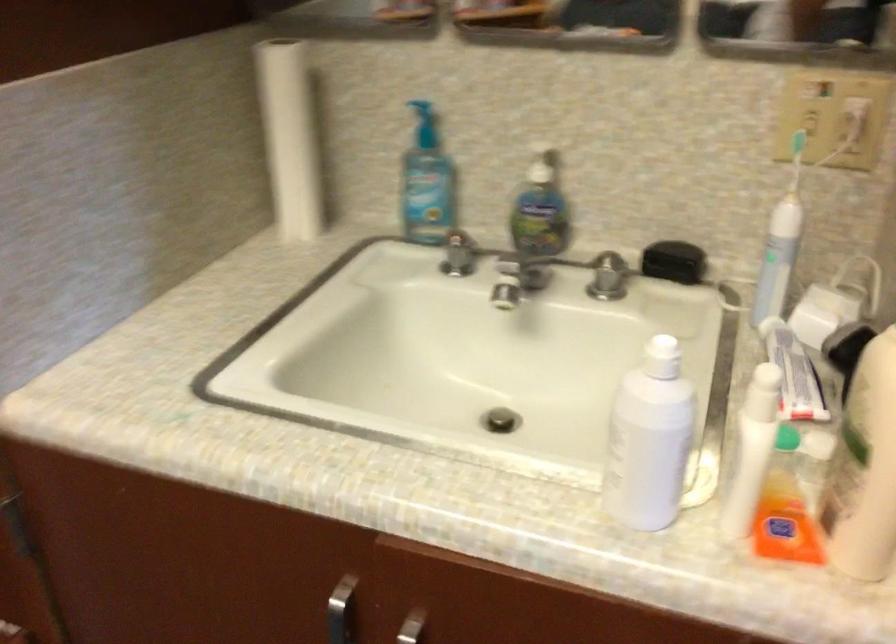
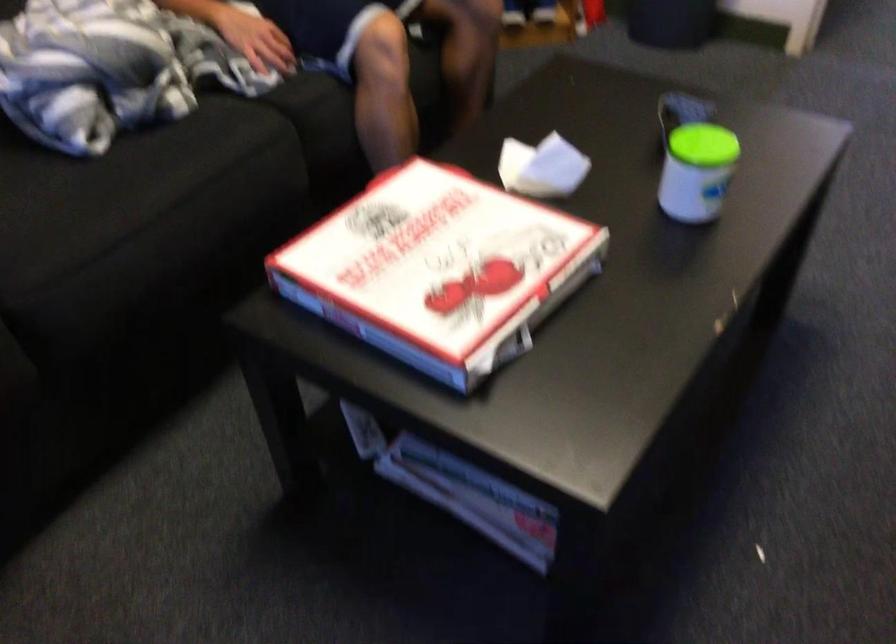
The images are taken continuously from a first-person perspective. In which direction is your viewpoint rotating?

The camera's rotation is toward left-down.